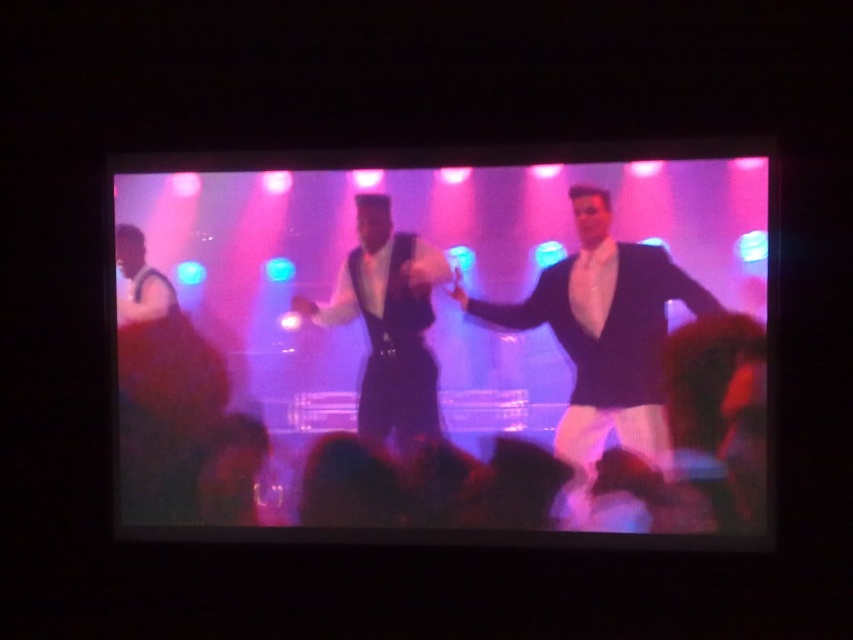
Based on the photo, you are a photographer in the audience. You want to capture a photo where the shiny black vest at center is on the left side of the matte black suit at center. Can you adjust your position to achieve this?

The matte black suit at center is positioned on the right side of the shiny black vest at center, so the current arrangement already has the shiny black vest at center on the left side of the matte black suit at center. Therefore, you don not need to adjust your position to achieve this.

Looking at this image, you are looking at the TV screen and notice two points marked on it. The first point is at coordinate point (752,262) and the second is at point (635,275). Which point appears closer to you on the screen?

Point (752,262) is closer to the camera than point (635,275), so the first point appears closer to you on the screen.